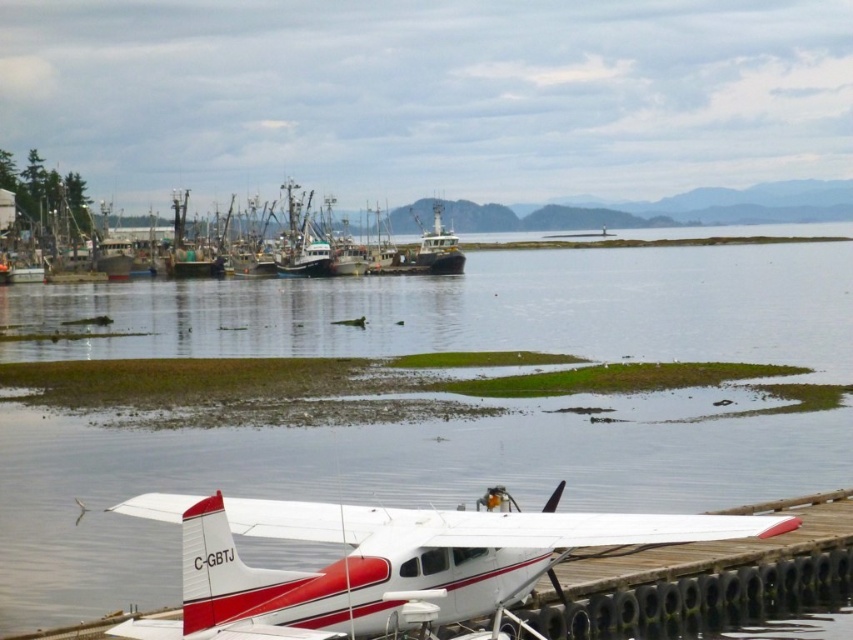
Which is below, clear water at center or white matte airplane at lower center?

white matte airplane at lower center is lower down.

How distant is clear water at center from white matte airplane at lower center?

clear water at center is 31.95 meters from white matte airplane at lower center.

This screenshot has height=640, width=853. What do you see at coordinates (374, 477) in the screenshot?
I see `clear water at center` at bounding box center [374, 477].

Identify the location of clear water at center. The height and width of the screenshot is (640, 853). [374, 477].

Is white matte airplane at lower center taller than green matte fishing boat at left?

In fact, white matte airplane at lower center may be shorter than green matte fishing boat at left.

This screenshot has width=853, height=640. Find the location of `white matte airplane at lower center`. white matte airplane at lower center is located at coordinates (386, 561).

I want to click on white matte airplane at lower center, so click(x=386, y=561).

Is point (74, 556) positioned behind point (15, 209)?

No, it is not.

Does clear water at center appear on the right side of green matte fishing boat at left?

Yes, clear water at center is to the right of green matte fishing boat at left.

Where is `clear water at center`? The height and width of the screenshot is (640, 853). clear water at center is located at coordinates (374, 477).

I want to click on clear water at center, so point(374,477).